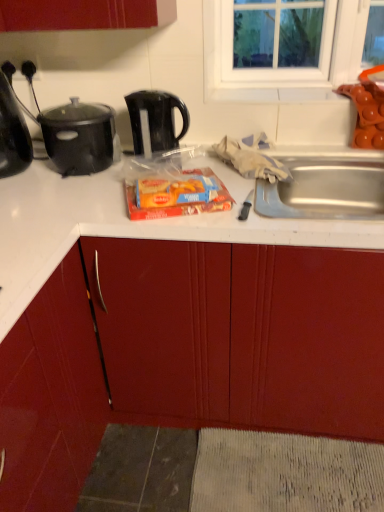
Question: Is black matte pot at upper left facing away from matte red cabinet at center?

Choices:
 (A) no
 (B) yes

Answer: (A)

Question: From the image's perspective, would you say black matte pot at upper left is shown under matte red cabinet at center?

Choices:
 (A) yes
 (B) no

Answer: (B)

Question: Does black matte pot at upper left have a smaller size compared to matte red cabinet at center?

Choices:
 (A) yes
 (B) no

Answer: (A)

Question: Is black matte pot at upper left thinner than matte red cabinet at center?

Choices:
 (A) no
 (B) yes

Answer: (B)

Question: Is black matte pot at upper left facing towards matte red cabinet at center?

Choices:
 (A) yes
 (B) no

Answer: (B)

Question: From a real-world perspective, is shiny black kettle at left above or below matte red cabinet at center?

Choices:
 (A) above
 (B) below

Answer: (A)

Question: From the image's perspective, is shiny black kettle at left positioned above or below matte red cabinet at center?

Choices:
 (A) above
 (B) below

Answer: (A)

Question: Is shiny black kettle at left bigger or smaller than matte red cabinet at center?

Choices:
 (A) small
 (B) big

Answer: (A)

Question: Is shiny black kettle at left inside or outside of matte red cabinet at center?

Choices:
 (A) inside
 (B) outside

Answer: (B)

Question: Is matte red cabinet at center spatially inside matte plastic snack pack at center, or outside of it?

Choices:
 (A) inside
 (B) outside

Answer: (B)

Question: Is matte red cabinet at center taller or shorter than matte plastic snack pack at center?

Choices:
 (A) short
 (B) tall

Answer: (B)

Question: Is matte red cabinet at center wider or thinner than matte plastic snack pack at center?

Choices:
 (A) thin
 (B) wide

Answer: (B)

Question: From a real-world perspective, is matte red cabinet at center physically located above or below matte plastic snack pack at center?

Choices:
 (A) below
 (B) above

Answer: (A)

Question: Based on their sizes in the image, would you say black plastic kettle at upper center is bigger or smaller than shiny black kettle at left?

Choices:
 (A) small
 (B) big

Answer: (A)

Question: Would you say black plastic kettle at upper center is to the left or to the right of shiny black kettle at left in the picture?

Choices:
 (A) right
 (B) left

Answer: (A)